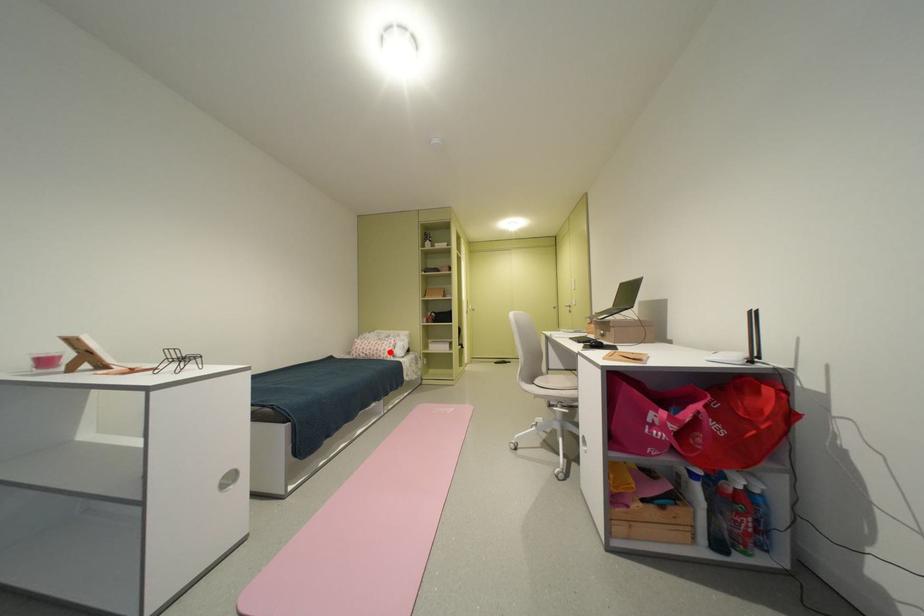
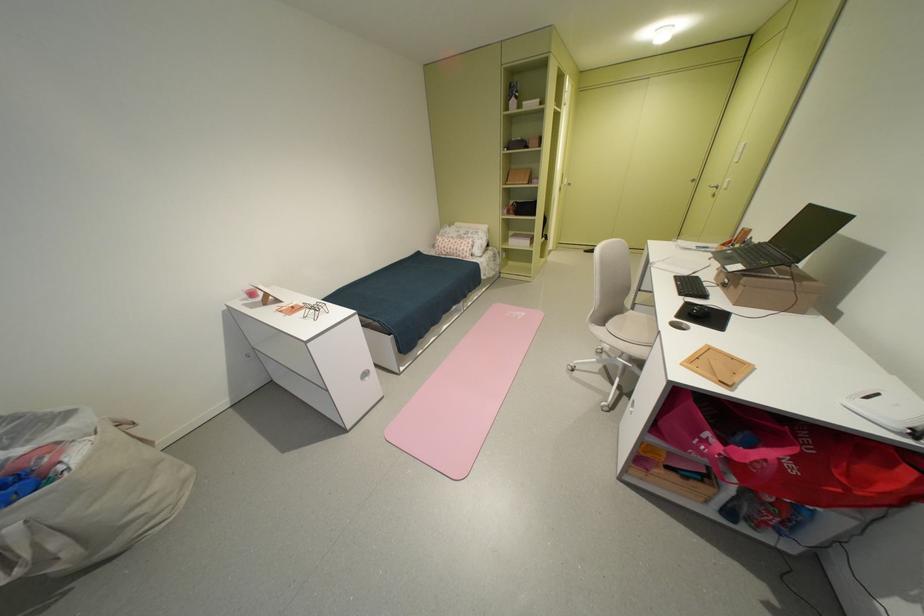
Question: I am providing you with two images of the same scene from different viewpoints. Image1 has a red point marked. In image2, the corresponding 3D location appears at what relative position? Reply with the corresponding letter.

Choices:
 (A) Closer
 (B) Farther

Answer: (A)